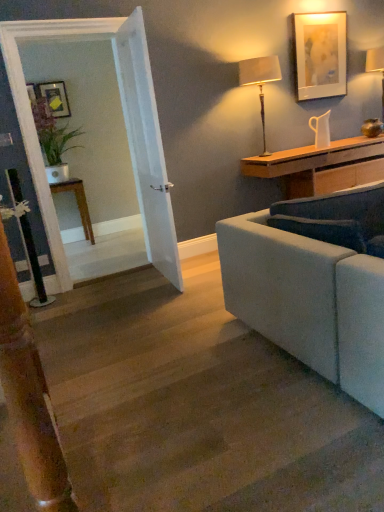
You are a GUI agent. You are given a task and a screenshot of the screen. Output one action in this format:
    pyautogui.click(x=<x>, y=<y>)
    Task: Click on the free spot in front of white wooden door at left
    The width and height of the screenshot is (384, 512).
    Given the screenshot: What is the action you would take?
    pyautogui.click(x=162, y=300)